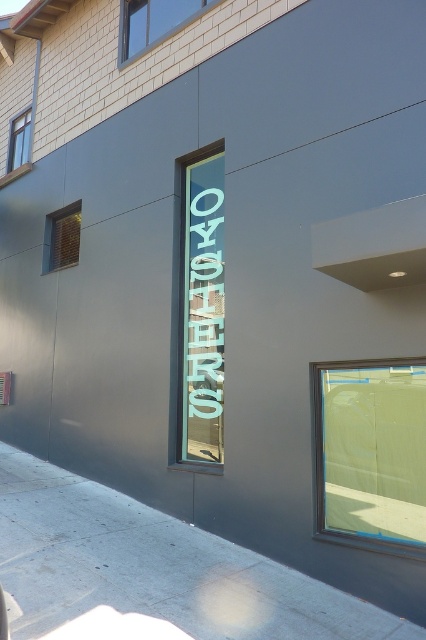
You are standing in front of the modern building and want to enter. You notice two windows, the clear glass window at center and the wooden window at upper left. Which window is closer to you?

The clear glass window at center is closer to you because it is in front of the wooden window at upper left.

From the picture: You are a delivery person trying to park your 2.5 meter wide delivery van. You see the gray concrete sidewalk at lower left and the clear glass window at center. Which area can accommodate your van?

The gray concrete sidewalk at lower left might be wider than clear glass window at center, so it is possible that the gray concrete sidewalk at lower left can accommodate the 2.5 meter wide delivery van.